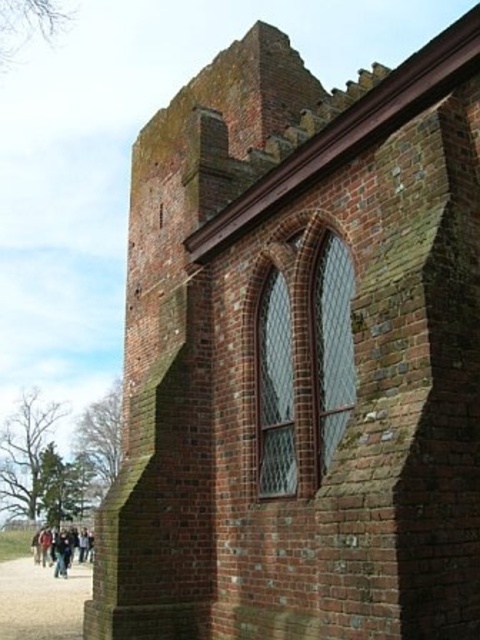
Question: Can you confirm if brown gravel path at lower left is positioned to the left of dark blue jeans at lower left?

Choices:
 (A) yes
 (B) no

Answer: (B)

Question: Which point is closer to the camera?

Choices:
 (A) brown gravel path at lower left
 (B) dark blue jeans at lower left

Answer: (A)

Question: Which point is farther to the camera?

Choices:
 (A) (23, 573)
 (B) (69, 541)

Answer: (A)

Question: Where is brown gravel path at lower left located in relation to dark blue jeans at lower left in the image?

Choices:
 (A) left
 (B) right

Answer: (B)

Question: Can you confirm if brown gravel path at lower left is smaller than dark blue jeans at lower left?

Choices:
 (A) yes
 (B) no

Answer: (B)